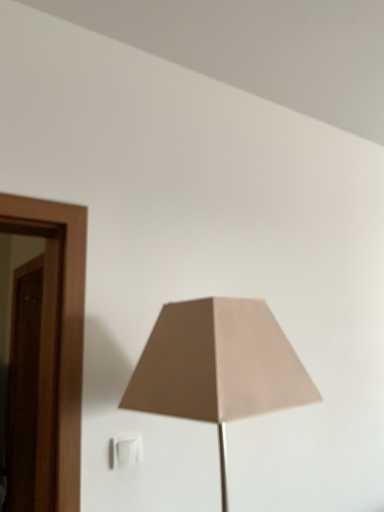
The image size is (384, 512). What do you see at coordinates (125, 451) in the screenshot? I see `white plastic electric outlet at lower center` at bounding box center [125, 451].

Image resolution: width=384 pixels, height=512 pixels. Find the location of `white plastic electric outlet at lower center`. white plastic electric outlet at lower center is located at coordinates (125, 451).

In order to face white plastic electric outlet at lower center, should I rotate leftwards or rightwards?

Turn left by 8.960 degrees to look at white plastic electric outlet at lower center.

Describe the element at coordinates (218, 366) in the screenshot. The height and width of the screenshot is (512, 384). I see `beige fabric lampshade at center` at that location.

At what (x,y) coordinates should I click in order to perform the action: click on beige fabric lampshade at center. Please return your answer as a coordinate pair (x, y). Looking at the image, I should click on (218, 366).

Measure the distance between point (301, 385) and camera.

The depth of point (301, 385) is 39.33 inches.

I want to click on white plastic electric outlet at lower center, so click(x=125, y=451).

Considering the relative positions of beige fabric lampshade at center and white plastic electric outlet at lower center in the image provided, is beige fabric lampshade at center to the right of white plastic electric outlet at lower center from the viewer's perspective?

Yes.

Is the position of beige fabric lampshade at center more distant than that of white plastic electric outlet at lower center?

No, it is in front of white plastic electric outlet at lower center.

Is point (278, 335) closer to viewer compared to point (139, 446)?

Yes, it is in front of point (139, 446).

From the image's perspective, which one is positioned higher, beige fabric lampshade at center or white plastic electric outlet at lower center?

From the image's view, beige fabric lampshade at center is above.

From a real-world perspective, between beige fabric lampshade at center and white plastic electric outlet at lower center, who is vertically lower?

From a 3D spatial view, white plastic electric outlet at lower center is below.

Is beige fabric lampshade at center wider than white plastic electric outlet at lower center?

Yes, beige fabric lampshade at center is wider than white plastic electric outlet at lower center.

Consider the image. Which of these two, beige fabric lampshade at center or white plastic electric outlet at lower center, stands shorter?

Standing shorter between the two is white plastic electric outlet at lower center.

Between beige fabric lampshade at center and white plastic electric outlet at lower center, which one has smaller size?

white plastic electric outlet at lower center.

Looking at this image, is beige fabric lampshade at center positioned beyond the bounds of white plastic electric outlet at lower center?

That's correct, beige fabric lampshade at center is outside of white plastic electric outlet at lower center.

Would you consider beige fabric lampshade at center to be distant from white plastic electric outlet at lower center?

No, there isn't a large distance between beige fabric lampshade at center and white plastic electric outlet at lower center.

Is beige fabric lampshade at center facing away from white plastic electric outlet at lower center?

Yes, beige fabric lampshade at center's orientation is away from white plastic electric outlet at lower center.

Image resolution: width=384 pixels, height=512 pixels. In order to click on lamp that is above the white plastic electric outlet at lower center (from the image's perspective) in this screenshot , I will do `click(218, 366)`.

Which object is positioned more to the left, white plastic electric outlet at lower center or beige fabric lampshade at center?

From the viewer's perspective, white plastic electric outlet at lower center appears more on the left side.

Which is in front, white plastic electric outlet at lower center or beige fabric lampshade at center?

beige fabric lampshade at center is more forward.

Does point (115, 453) appear closer or farther from the camera than point (198, 364)?

Point (115, 453) is farther from the camera than point (198, 364).

From the image's perspective, is white plastic electric outlet at lower center above beige fabric lampshade at center?

No, from the image's perspective, white plastic electric outlet at lower center is not over beige fabric lampshade at center.

From a real-world perspective, is white plastic electric outlet at lower center physically located above or below beige fabric lampshade at center?

Clearly, from a real-world perspective, white plastic electric outlet at lower center is below beige fabric lampshade at center.

Considering the relative sizes of white plastic electric outlet at lower center and beige fabric lampshade at center in the image provided, is white plastic electric outlet at lower center thinner than beige fabric lampshade at center?

Yes, white plastic electric outlet at lower center is thinner than beige fabric lampshade at center.

Consider the image. Can you confirm if white plastic electric outlet at lower center is taller than beige fabric lampshade at center?

In fact, white plastic electric outlet at lower center may be shorter than beige fabric lampshade at center.

Who is bigger, white plastic electric outlet at lower center or beige fabric lampshade at center?

beige fabric lampshade at center is bigger.

Would you say white plastic electric outlet at lower center contains beige fabric lampshade at center?

No.

Is white plastic electric outlet at lower center next to beige fabric lampshade at center and touching it?

No, white plastic electric outlet at lower center is not in contact with beige fabric lampshade at center.

Could you tell me if white plastic electric outlet at lower center is facing beige fabric lampshade at center?

Yes, white plastic electric outlet at lower center faces towards beige fabric lampshade at center.

Looking at this image, can you tell me how much white plastic electric outlet at lower center and beige fabric lampshade at center differ in facing direction?

They differ by 6.02 degrees in their facing directions.

Could you measure the distance between white plastic electric outlet at lower center and beige fabric lampshade at center?

A distance of 17.13 inches exists between white plastic electric outlet at lower center and beige fabric lampshade at center.

The height and width of the screenshot is (512, 384). Identify the location of lamp above the white plastic electric outlet at lower center (from a real-world perspective). (218, 366).

At what (x,y) coordinates should I click in order to perform the action: click on electric outlet below the beige fabric lampshade at center (from the image's perspective). Please return your answer as a coordinate pair (x, y). Looking at the image, I should click on (125, 451).

This screenshot has width=384, height=512. What are the coordinates of `lamp positioned vertically above the white plastic electric outlet at lower center (from a real-world perspective)` in the screenshot? It's located at (218, 366).